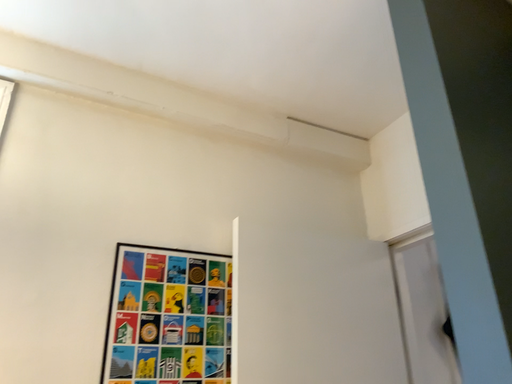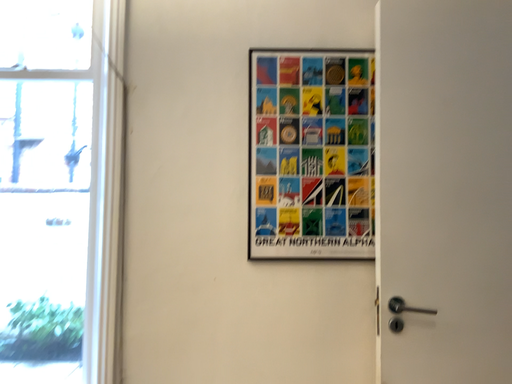
Question: How did the camera likely rotate when shooting the video?

Choices:
 (A) rotated downward
 (B) rotated upward

Answer: (A)